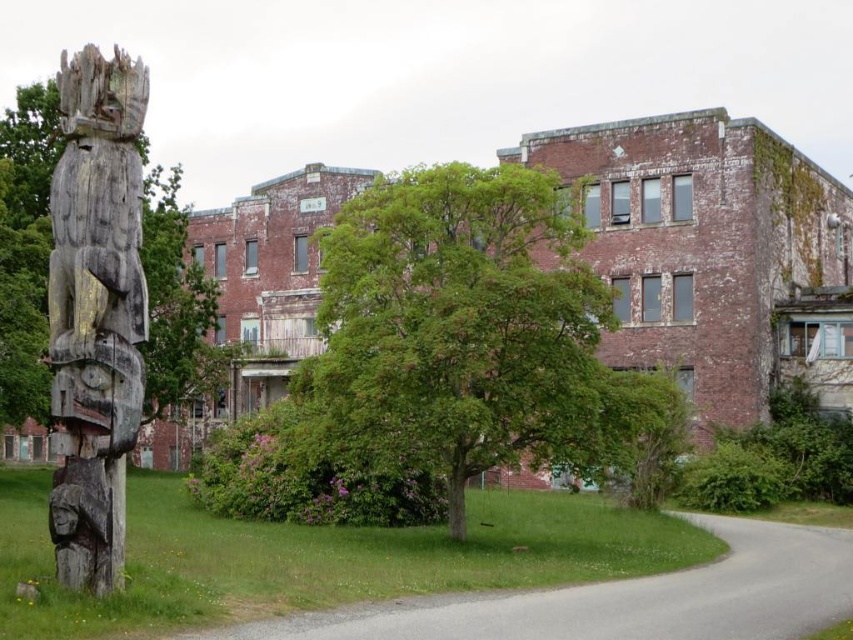
Does weathered wood totem pole at left have a smaller size compared to green rough bark tree at center?

Yes, weathered wood totem pole at left is smaller than green rough bark tree at center.

Is the position of weathered wood totem pole at left less distant than that of green rough bark tree at center?

That is True.

Is point (61, 308) more distant than point (195, 337)?

No, it is in front of (195, 337).

Identify the location of weathered wood totem pole at left. The width and height of the screenshot is (853, 640). (96, 310).

Does green leafy tree at center have a lesser width compared to weathered wood totem pole at left?

Yes.

Looking at this image, can you confirm if green leafy tree at center is wider than weathered wood totem pole at left?

No.

Does point (526, 240) lie in front of point (93, 362)?

No.

This screenshot has width=853, height=640. Find the location of `green leafy tree at center`. green leafy tree at center is located at coordinates (457, 326).

Is green leafy tree at center wider than green rough bark tree at center?

In fact, green leafy tree at center might be narrower than green rough bark tree at center.

Which of these two, green leafy tree at center or green rough bark tree at center, stands shorter?

green leafy tree at center

The image size is (853, 640). What are the coordinates of `green leafy tree at center` in the screenshot? It's located at (457, 326).